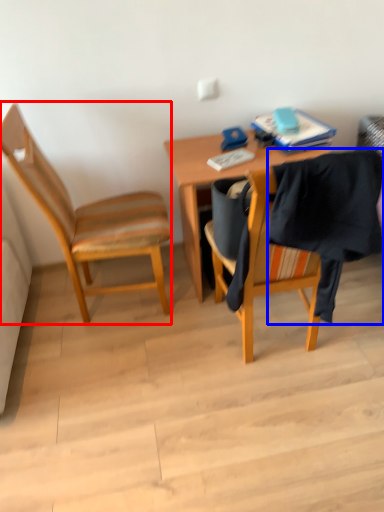
Question: Which of the following is the farthest to the observer, chair (highlighted by a red box) or clothe (highlighted by a blue box)?

Choices:
 (A) chair
 (B) clothe

Answer: (A)